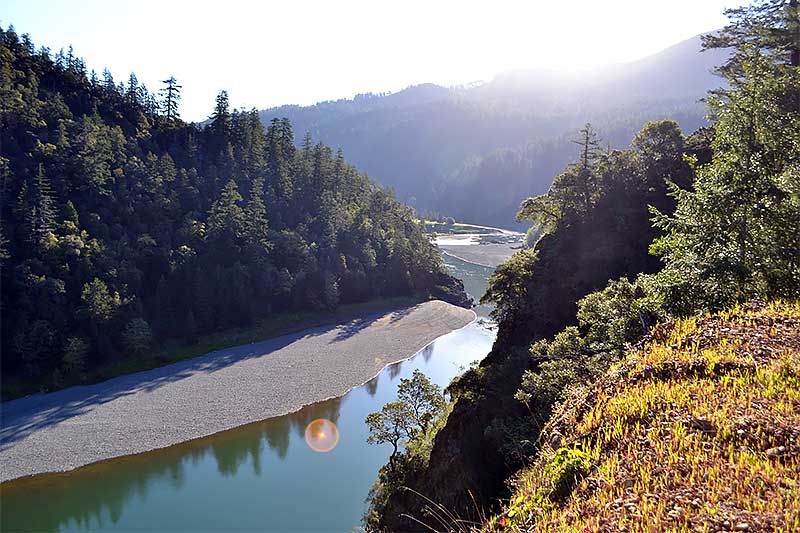
Identify the location of light. [x=330, y=433].